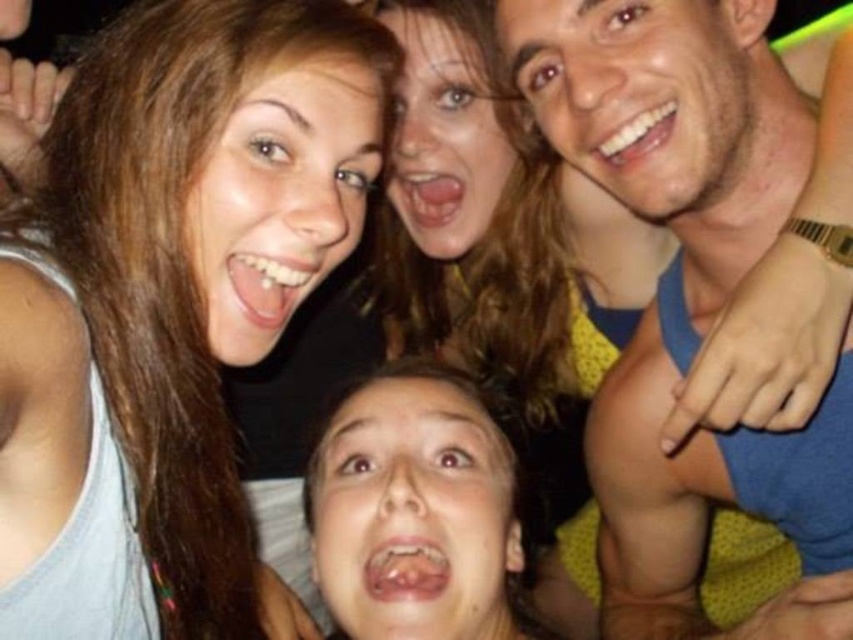
You are a photographer trying to capture a group photo. You have a camera with a 20 inch wide lens. Can you fit both the matte gray tank top at lower left and the matte black top at upper center into the frame without moving the camera?

The distance between the matte gray tank top at lower left and the matte black top at upper center is 22.55 inches. Since the lens is only 20 inches wide, the camera cannot capture both objects in the frame without moving.

Looking at this image, you are a photographer trying to adjust the lighting for a photo shoot. You notice the matte gray tank top at lower left and the smooth skin man at upper right. Which object is positioned lower in the image?

The matte gray tank top at lower left is located below the smooth skin man at upper right, so it is positioned lower in the image.